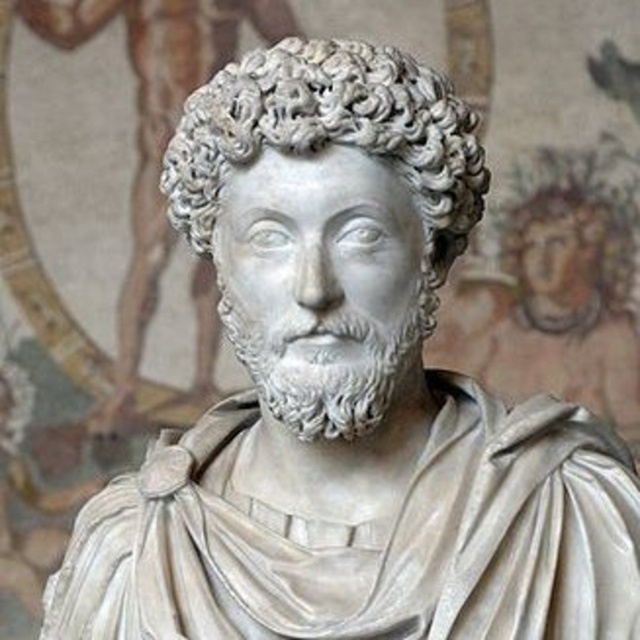
Question: Is white marble head at center wider than white marble head at upper right?

Choices:
 (A) yes
 (B) no

Answer: (A)

Question: Based on their relative distances, which object is nearer to the white marble head at center?

Choices:
 (A) white marble head at upper right
 (B) white marble bust at center

Answer: (B)

Question: Is white marble head at center further to camera compared to white marble bust at center?

Choices:
 (A) no
 (B) yes

Answer: (A)

Question: Which object is the farthest from the white marble head at center?

Choices:
 (A) white marble head at upper right
 (B) white marble bust at center

Answer: (A)

Question: Which is farther from the white marble bust at center?

Choices:
 (A) white marble head at center
 (B) white marble head at upper right

Answer: (A)

Question: Is the position of white marble head at center less distant than that of white marble head at upper right?

Choices:
 (A) no
 (B) yes

Answer: (B)